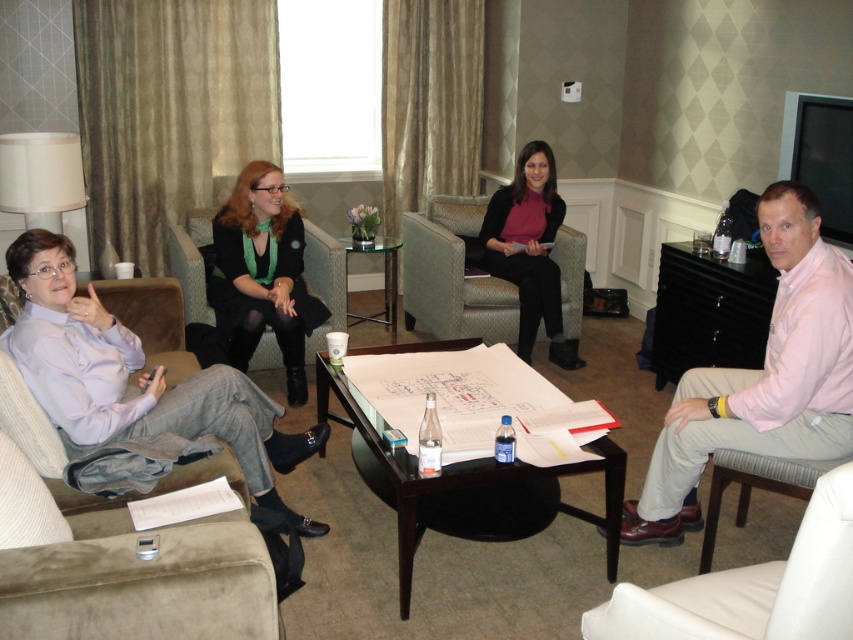
Question: Is white leather chair at lower right below matte black jacket at center?

Choices:
 (A) no
 (B) yes

Answer: (B)

Question: Can you confirm if white leather chair at lower right is positioned to the right of matte black sweater at center?

Choices:
 (A) no
 (B) yes

Answer: (B)

Question: Is white leather chair at lower right to the left of matte black jacket at center from the viewer's perspective?

Choices:
 (A) yes
 (B) no

Answer: (B)

Question: Which point is closer to the camera taking this photo?

Choices:
 (A) (807, 298)
 (B) (300, 358)

Answer: (A)

Question: Which object is positioned closest to the matte black sweater at center?

Choices:
 (A) white leather chair at lower right
 (B) matte black jacket at center

Answer: (B)

Question: Estimate the real-world distances between objects in this image. Which object is farther from the matte black jacket at center?

Choices:
 (A) pink cotton shirt at right
 (B) white leather chair at lower right
 (C) matte black sweater at center
 (D) suede couch at left

Answer: (B)